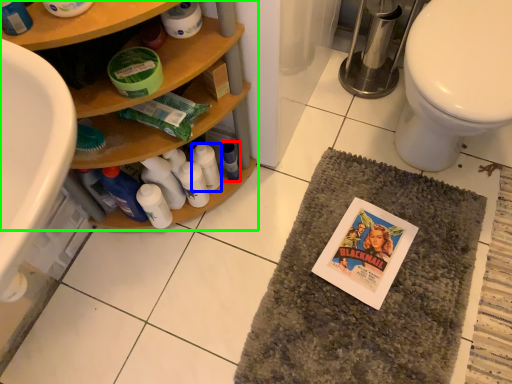
Question: Estimate the real-world distances between objects in this image. Which object is closer to bottle (highlighted by a red box), bottle (highlighted by a blue box) or bathroom cabinet (highlighted by a green box)?

Choices:
 (A) bottle
 (B) bathroom cabinet

Answer: (A)